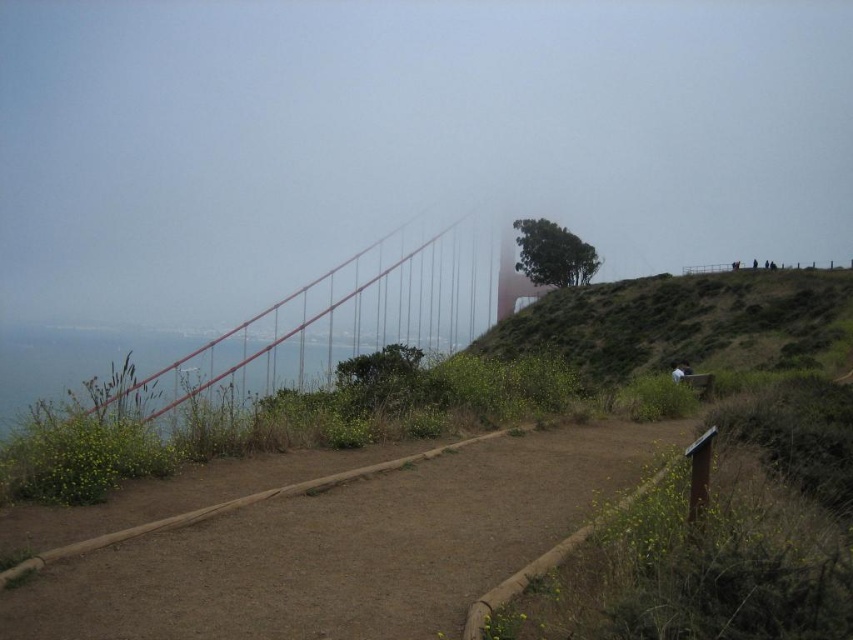
You are a hiker standing on the dirt path and want to take a photo of both the metallic red suspension bridge at center and the green leafy bush at center. Which object should you frame first in your camera viewfinder to ensure both are in the shot?

You should frame the metallic red suspension bridge at center first because it is positioned to the left of the green leafy bush at center, so starting with the bridge ensures both objects are captured in the frame.